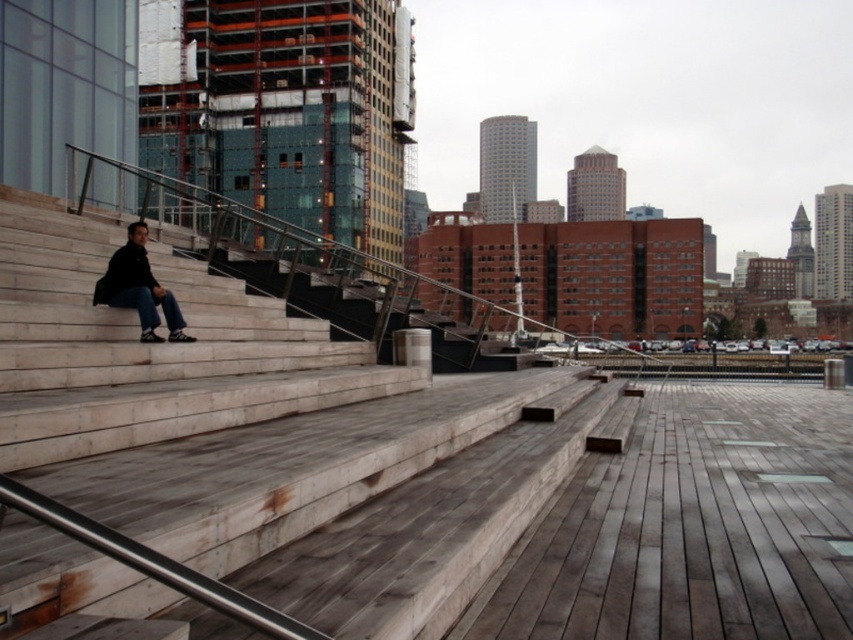
The image size is (853, 640). What do you see at coordinates (271, 438) in the screenshot? I see `wooden stairs at left` at bounding box center [271, 438].

Does point (229, 445) lie behind point (106, 304)?

No, it is not.

Identify the location of wooden stairs at left. The image size is (853, 640). (271, 438).